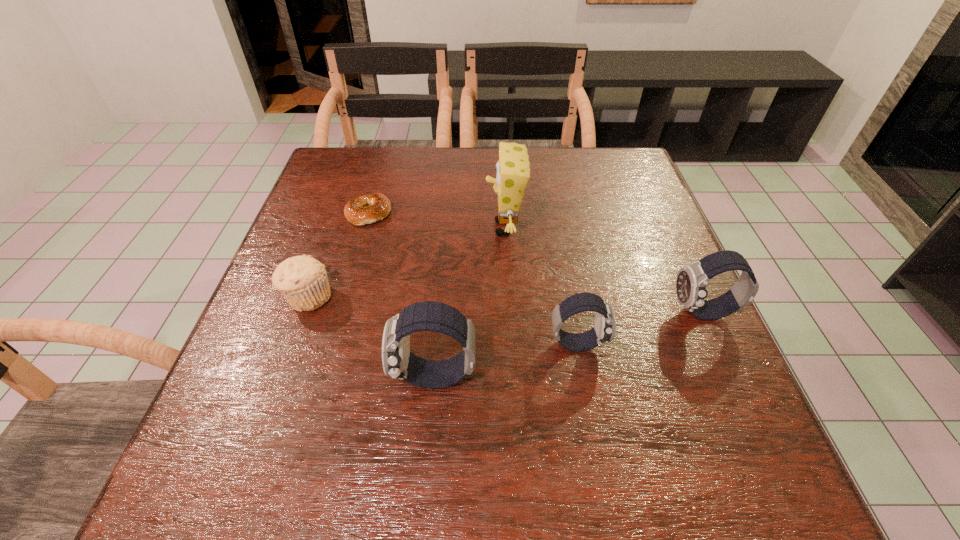
I want to click on object at the near edge, so click(x=398, y=362).

Locate an element on the screen. This screenshot has height=540, width=960. bagel that is at the left edge is located at coordinates (366, 209).

Where is `muffin that is at the left edge`? The image size is (960, 540). muffin that is at the left edge is located at coordinates (303, 281).

You are a GUI agent. You are given a task and a screenshot of the screen. Output one action in this format:
    pyautogui.click(x=<x>, y=<y>)
    Task: Click on the object located at the right edge
    The image size is (960, 540).
    Given the screenshot: What is the action you would take?
    pyautogui.click(x=691, y=284)

Identify the location of free point at the far edge. (417, 190).

In the image, there is a desktop. Identify the location of free space at the near edge. [x=430, y=413].

This screenshot has height=540, width=960. I want to click on free spot at the left edge of the desktop, so click(324, 196).

Identify the location of vacant space at the right edge of the desktop. (636, 265).

In order to click on vacant area at the far left corner of the desktop in this screenshot , I will do `click(324, 172)`.

Where is `vacant space at the near left corner of the desktop`? The height and width of the screenshot is (540, 960). vacant space at the near left corner of the desktop is located at coordinates (301, 404).